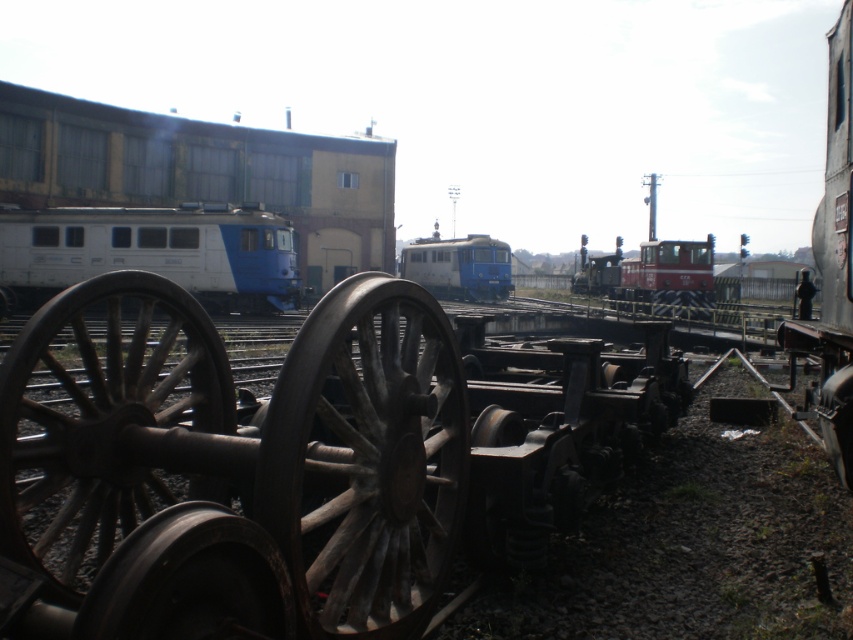
You are standing at the railway yard and want to walk from the point at coordinates point (231, 252) to the point at coordinates point (830, 177). According to the image, which direction should you head to reach your destination?

Since point (231, 252) is behind point (830, 177), you should head forward to reach your destination.

You are standing at the center of the railway yard and want to locate the rusty metal wheel at lower left. According to the coordinates provided, in which direction should you look to find it?

The rusty metal wheel at lower left is located at coordinates point (103, 420), so you should look towards the lower left direction to find it.

You are a railway inspector checking the railway yard. You need to determine which train has a greater width between the white glossy train at left and the rusty metal train at right. Based on the scene, which one is wider?

The white glossy train at left is wider than the rusty metal train at right according to the description provided.